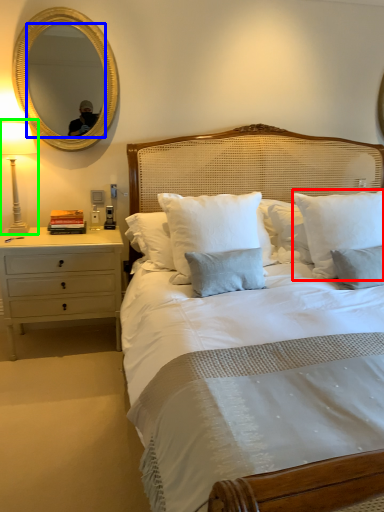
Question: Estimate the real-world distances between objects in this image. Which object is farther from pillow (highlighted by a red box), mirror (highlighted by a blue box) or bedside lamp (highlighted by a green box)?

Choices:
 (A) mirror
 (B) bedside lamp

Answer: (B)